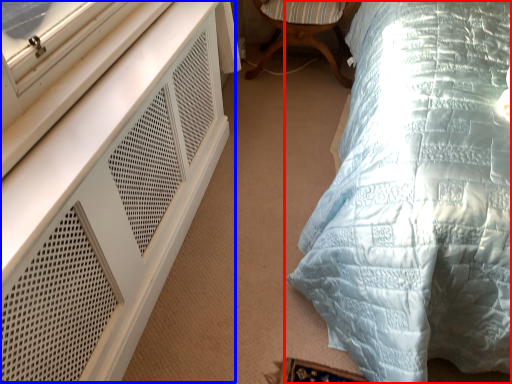
Question: Which of the following is the closest to the observer, bed (highlighted by a red box) or dresser (highlighted by a blue box)?

Choices:
 (A) bed
 (B) dresser

Answer: (A)